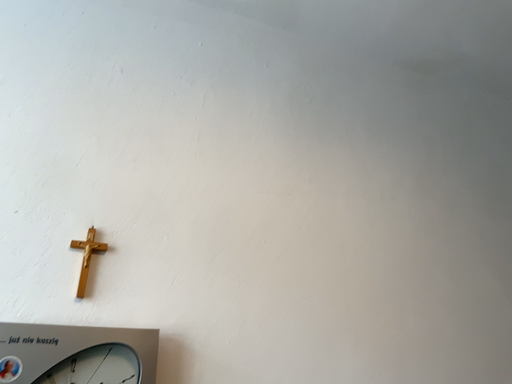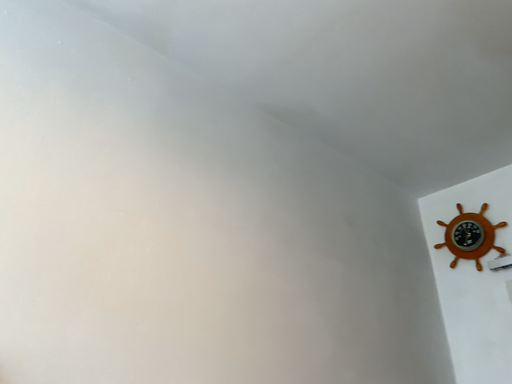
Question: Which way did the camera rotate in the video?

Choices:
 (A) rotated right
 (B) rotated left

Answer: (A)